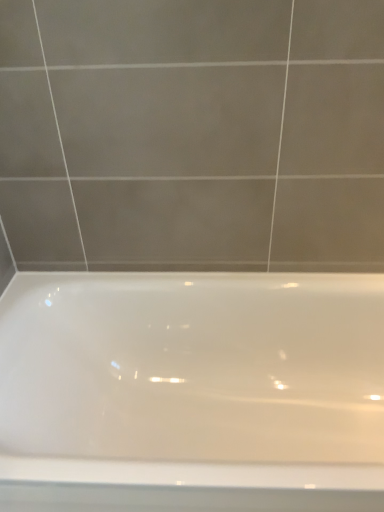
At what (x,y) coordinates should I click in order to perform the action: click on white glossy bathtub at center. Please return your answer as a coordinate pair (x, y). Looking at the image, I should click on (192, 391).

The width and height of the screenshot is (384, 512). What do you see at coordinates (192, 391) in the screenshot?
I see `white glossy bathtub at center` at bounding box center [192, 391].

In order to click on white glossy bathtub at center in this screenshot , I will do `click(192, 391)`.